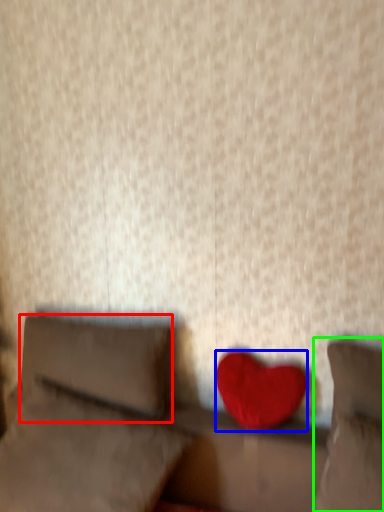
Question: Which object is positioned closest to pillow (highlighted by a red box)? Select from heart (highlighted by a blue box) and pillow (highlighted by a green box).

Choices:
 (A) heart
 (B) pillow

Answer: (A)